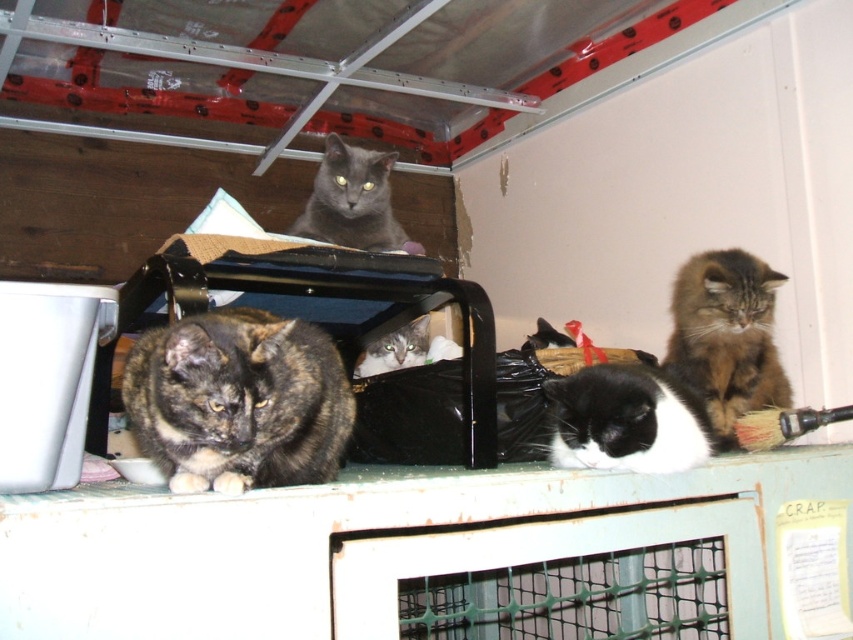
You are a small robot with a width of 18 inches. You need to move from the white plastic ledge at center to the gray fur cat at center. Can you fit through the space between them?

The distance between the white plastic ledge at center and gray fur cat at center is 22.40 inches, which is wider than your 18 inches width, so yes, you can fit through the space between them.

You are a cat owner trying to place a new white plastic ledge at center in this storage area. The two cats in the foreground are currently 23.25 inches apart. If you want to place the ledge between them, will there be enough space?

The two cats in the foreground are 23.25 inches apart, so placing the white plastic ledge at center between them would require at least that much space. Since the ledge itself isn